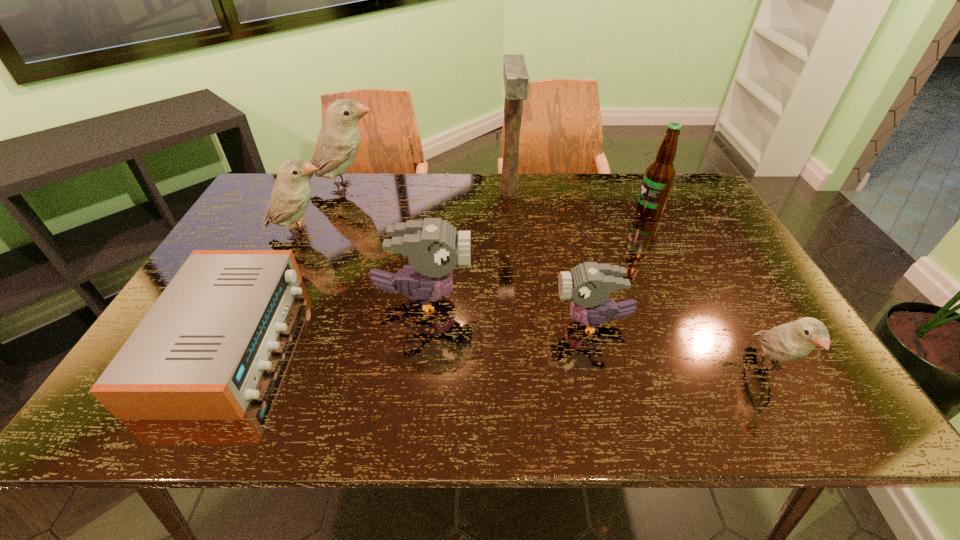
The width and height of the screenshot is (960, 540). I want to click on vacant space at the near edge of the desktop, so click(729, 420).

Where is `free space at the far right corner of the desktop`? The height and width of the screenshot is (540, 960). free space at the far right corner of the desktop is located at coordinates (687, 191).

Identify the location of free point between the farthest bird and the tallest object. This screenshot has width=960, height=540. (427, 190).

Identify the location of free space between the mallet and the right gray bird. The height and width of the screenshot is (540, 960). (551, 258).

This screenshot has height=540, width=960. I want to click on vacant area that lies between the second farthest bird and the biggest white bird, so click(323, 211).

Identify the location of free space between the nearest white bird and the fourth nearest bird. This screenshot has width=960, height=540. (535, 301).

Find the location of a particular element. The width and height of the screenshot is (960, 540). free point between the fifth object from left to right and the smaller gray bird is located at coordinates (551, 258).

At what (x,y) coordinates should I click in order to perform the action: click on free space between the smallest white bird and the second smallest white bird. Please return your answer as a coordinate pair (x, y). Looking at the image, I should click on (535, 301).

Find the location of a particular element. This screenshot has height=540, width=960. vacant region between the third bird from right to left and the shortest object is located at coordinates (325, 319).

Locate an element on the screen. object that is the second closest to the smaller gray bird is located at coordinates (791, 341).